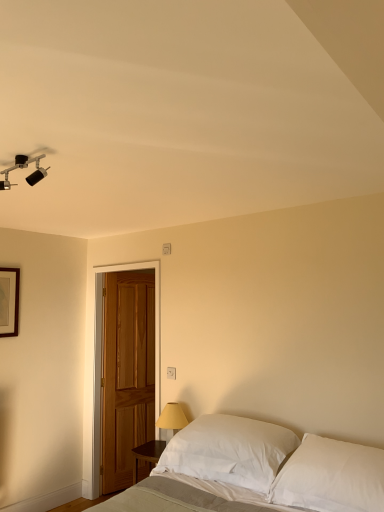
Question: From a real-world perspective, is white cotton pillow at lower right, which ranks as the first pillow in right-to-left order, physically below matte black track light at upper left?

Choices:
 (A) yes
 (B) no

Answer: (A)

Question: Considering the relative sizes of white cotton pillow at lower right, which ranks as the first pillow in right-to-left order, and matte black track light at upper left in the image provided, is white cotton pillow at lower right, which ranks as the first pillow in right-to-left order, taller than matte black track light at upper left?

Choices:
 (A) no
 (B) yes

Answer: (B)

Question: Can you confirm if white cotton pillow at lower right, placed as the 2th pillow when sorted from left to right, is positioned to the right of matte black track light at upper left?

Choices:
 (A) no
 (B) yes

Answer: (B)

Question: From a real-world perspective, is white cotton pillow at lower right, placed as the 2th pillow when sorted from left to right, on top of matte black track light at upper left?

Choices:
 (A) yes
 (B) no

Answer: (B)

Question: From the image's perspective, is white cotton pillow at lower right, placed as the 2th pillow when sorted from left to right, on matte black track light at upper left?

Choices:
 (A) no
 (B) yes

Answer: (A)

Question: Does white cotton pillow at lower right, placed as the 2th pillow when sorted from left to right, have a larger size compared to matte black track light at upper left?

Choices:
 (A) no
 (B) yes

Answer: (B)

Question: Is wooden door at left at the back of white plastic electric outlet at center?

Choices:
 (A) yes
 (B) no

Answer: (B)

Question: Is white plastic electric outlet at center bigger than wooden door at left?

Choices:
 (A) no
 (B) yes

Answer: (A)

Question: Does white plastic electric outlet at center have a greater width compared to wooden door at left?

Choices:
 (A) no
 (B) yes

Answer: (A)

Question: Could you tell me if white plastic electric outlet at center is facing wooden door at left?

Choices:
 (A) yes
 (B) no

Answer: (B)

Question: Is wooden door at left located within white plastic electric outlet at center?

Choices:
 (A) no
 (B) yes

Answer: (A)

Question: Does white plastic electric outlet at center touch wooden door at left?

Choices:
 (A) yes
 (B) no

Answer: (B)

Question: Is wooden picture frame at upper left turned away from white soft bed at lower center?

Choices:
 (A) no
 (B) yes

Answer: (A)